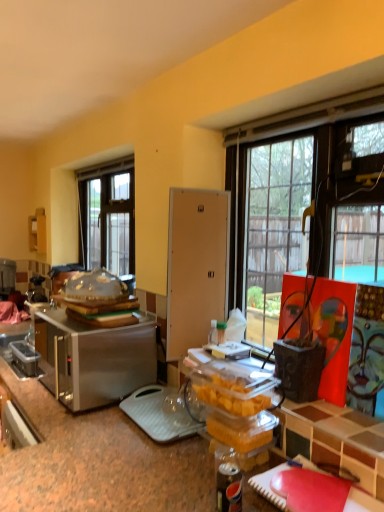
Question: Is clear plastic dome at center positioned beyond the bounds of matte white cabinet at left?

Choices:
 (A) yes
 (B) no

Answer: (A)

Question: Does clear plastic dome at center have a lesser width compared to matte white cabinet at left?

Choices:
 (A) yes
 (B) no

Answer: (B)

Question: Is clear plastic dome at center in contact with matte white cabinet at left?

Choices:
 (A) no
 (B) yes

Answer: (A)

Question: Is clear plastic dome at center wider than matte white cabinet at left?

Choices:
 (A) no
 (B) yes

Answer: (B)

Question: Can you confirm if clear plastic dome at center is taller than matte white cabinet at left?

Choices:
 (A) no
 (B) yes

Answer: (A)

Question: Considering the relative sizes of clear plastic dome at center and matte white cabinet at left in the image provided, is clear plastic dome at center bigger than matte white cabinet at left?

Choices:
 (A) yes
 (B) no

Answer: (A)

Question: Is the position of clear glass window at upper left more distant than that of brushed metal toaster at left, which appears as the second appliance when viewed from the right?

Choices:
 (A) yes
 (B) no

Answer: (B)

Question: Is clear glass window at upper left shorter than brushed metal toaster at left, which appears as the second appliance when viewed from the right?

Choices:
 (A) yes
 (B) no

Answer: (B)

Question: Is clear glass window at upper left at the left side of brushed metal toaster at left, which appears as the second appliance when viewed from the right?

Choices:
 (A) yes
 (B) no

Answer: (B)

Question: Can you confirm if clear glass window at upper left is bigger than brushed metal toaster at left, which is the 1th appliance from back to front?

Choices:
 (A) no
 (B) yes

Answer: (B)

Question: Is clear glass window at upper left next to brushed metal toaster at left, the first appliance viewed from the left?

Choices:
 (A) no
 (B) yes

Answer: (A)

Question: Does clear glass window at upper left lie in front of brushed metal toaster at left, which appears as the second appliance when viewed from the right?

Choices:
 (A) no
 (B) yes

Answer: (B)

Question: Is matte white cabinet at left outside of satin silver toaster at left, marked as the first appliance in a front-to-back arrangement?

Choices:
 (A) no
 (B) yes

Answer: (B)